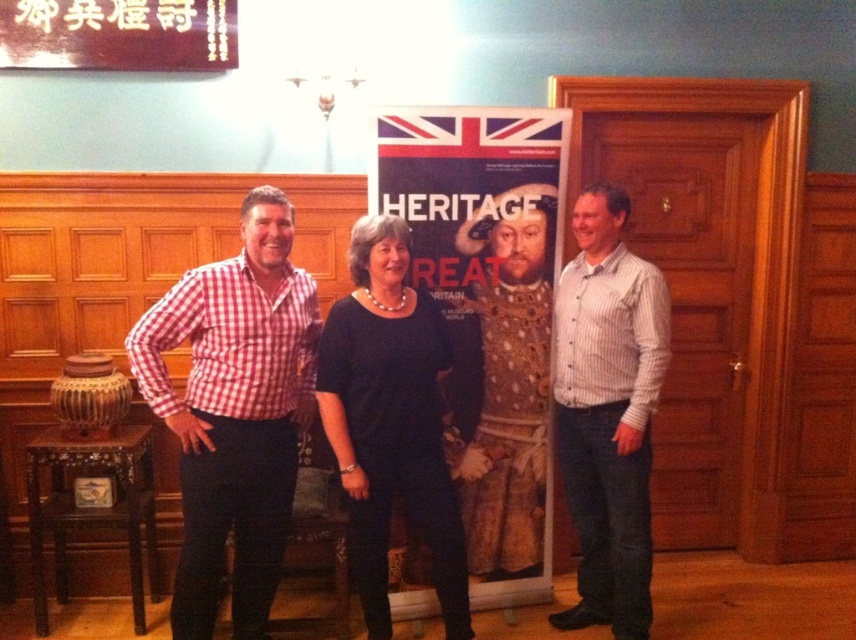
Is matte paper poster at center shorter than red checkered shirt at left?

No.

Does point (504, 436) come closer to viewer compared to point (251, 620)?

No.

Between point (443, 193) and point (199, 515), which one is positioned in front?

Positioned in front is point (199, 515).

Locate an element on the screen. The width and height of the screenshot is (856, 640). matte paper poster at center is located at coordinates (486, 312).

Is point (403, 218) positioned behind point (556, 444)?

No, (403, 218) is in front of (556, 444).

Between matte paper poster at center and white striped shirt at right, which one appears on the right side from the viewer's perspective?

white striped shirt at right

Who is more forward, (538, 186) or (608, 529)?

Point (538, 186) is in front.

Locate an element on the screen. This screenshot has width=856, height=640. matte paper poster at center is located at coordinates (486, 312).

Between point (560, 173) and point (28, 490), which one is positioned behind?

Positioned behind is point (560, 173).

Who is more forward, (506, 454) or (48, 502)?

Point (48, 502) is more forward.

Is point (443, 150) farther from viewer compared to point (91, 512)?

No.

You are a GUI agent. You are given a task and a screenshot of the screen. Output one action in this format:
    pyautogui.click(x=<x>, y=<y>)
    Task: Click on the matte paper poster at center
    Image resolution: width=856 pixels, height=640 pixels.
    Given the screenshot: What is the action you would take?
    pyautogui.click(x=486, y=312)